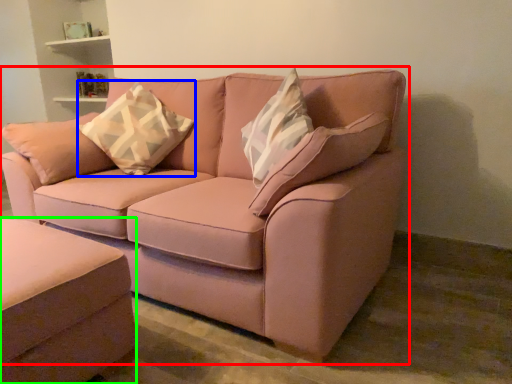
Question: Estimate the real-world distances between objects in this image. Which object is farther from studio couch (highlighted by a red box), throw pillow (highlighted by a blue box) or studio couch (highlighted by a green box)?

Choices:
 (A) throw pillow
 (B) studio couch

Answer: (B)